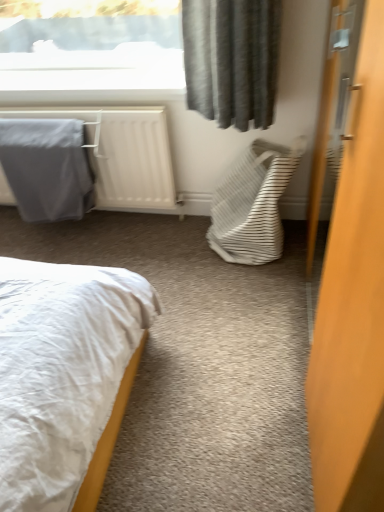
The width and height of the screenshot is (384, 512). What do you see at coordinates (122, 153) in the screenshot?
I see `gray fabric at left` at bounding box center [122, 153].

Describe the element at coordinates (47, 168) in the screenshot. I see `gray fabric blanket at left` at that location.

What are the coordinates of `gray fabric at left` in the screenshot? It's located at (122, 153).

Looking at this image, does white striped fabric laundry basket at center-right have a larger size compared to wooden door at right?

No, white striped fabric laundry basket at center-right is not bigger than wooden door at right.

Considering the points (270, 152) and (373, 45), which point is behind, point (270, 152) or point (373, 45)?

The point (270, 152) is farther.

Is white striped fabric laundry basket at center-right far from wooden door at right?

That's not correct — white striped fabric laundry basket at center-right is a little close to wooden door at right.

From the picture: From the image's perspective, is white striped fabric laundry basket at center-right positioned above or below wooden door at right?

From the image's perspective, white striped fabric laundry basket at center-right appears above wooden door at right.

Is white striped fabric laundry basket at center-right positioned far away from gray fabric blanket at left?

Actually, white striped fabric laundry basket at center-right and gray fabric blanket at left are a little close together.

Measure the distance from white striped fabric laundry basket at center-right to gray fabric blanket at left.

They are 82.64 centimeters apart.

Is white striped fabric laundry basket at center-right looking in the opposite direction of gray fabric blanket at left?

No, white striped fabric laundry basket at center-right's orientation is not away from gray fabric blanket at left.

Find the location of a particular element. This screenshot has width=384, height=512. blanket located behind the white striped fabric laundry basket at center-right is located at coordinates (47, 168).

Is gray fabric blanket at left positioned with its back to white striped fabric laundry basket at center-right?

gray fabric blanket at left does not have its back to white striped fabric laundry basket at center-right.

Is the surface of gray fabric blanket at left in direct contact with white striped fabric laundry basket at center-right?

No.

Looking at the image, does gray fabric blanket at left seem bigger or smaller compared to white striped fabric laundry basket at center-right?

In the image, gray fabric blanket at left appears to be smaller than white striped fabric laundry basket at center-right.

Is point (67, 154) positioned after point (271, 176)?

Yes.

Is point (367, 409) closer or farther from the camera than point (65, 137)?

Point (367, 409) is closer to the camera than point (65, 137).

In the scene shown: From a real-world perspective, is wooden door at right physically located above or below gray fabric blanket at left?

Clearly, from a real-world perspective, wooden door at right is above gray fabric blanket at left.

Which is correct: wooden door at right is inside gray fabric blanket at left, or outside of it?

wooden door at right lies outside gray fabric blanket at left.

Would you say wooden door at right is outside gray fabric at left?

wooden door at right is positioned outside gray fabric at left.

Which of these two, wooden door at right or gray fabric at left, is smaller?

With smaller size is gray fabric at left.

Which object is thinner, wooden door at right or gray fabric at left?

With smaller width is wooden door at right.

Is wooden door at right positioned before gray fabric at left?

Yes, it is in front of gray fabric at left.

From the image's perspective, between gray fabric blanket at left and gray fabric at left, which one is located above?

gray fabric at left, from the image's perspective.

Who is more distant, gray fabric blanket at left or gray fabric at left?

gray fabric blanket at left is further from the camera.

From a real-world perspective, is gray fabric blanket at left physically located above or below gray fabric at left?

Clearly, from a real-world perspective, gray fabric blanket at left is below gray fabric at left.

Is gray fabric blanket at left looking in the opposite direction of gray fabric at left?

Yes, gray fabric blanket at left is facing away from gray fabric at left.

Considering the sizes of objects gray fabric at left and gray fabric blanket at left in the image provided, who is bigger, gray fabric at left or gray fabric blanket at left?

gray fabric at left is bigger.

From the image's perspective, who appears lower, gray fabric at left or gray fabric blanket at left?

gray fabric blanket at left.

Could you tell me if gray fabric at left is turned towards gray fabric blanket at left?

Yes, gray fabric at left is aimed at gray fabric blanket at left.

In the scene shown: Would you say gray fabric at left is to the left or to the right of gray fabric blanket at left in the picture?

gray fabric at left is positioned on gray fabric blanket at left's left side.

Identify the location of door on the right of white striped fabric laundry basket at center-right. Image resolution: width=384 pixels, height=512 pixels. (353, 305).

The image size is (384, 512). Identify the location of blanket lying on the left of white striped fabric laundry basket at center-right. (47, 168).

Estimate the real-world distances between objects in this image. Which object is further from white striped fabric laundry basket at center-right, gray fabric at left or wooden door at right?

wooden door at right is positioned further to the anchor white striped fabric laundry basket at center-right.

Estimate the real-world distances between objects in this image. Which object is closer to wooden door at right, white striped fabric laundry basket at center-right or gray fabric at left?

Based on the image, white striped fabric laundry basket at center-right appears to be nearer to wooden door at right.

Estimate the real-world distances between objects in this image. Which object is further from white striped fabric laundry basket at center-right, gray fabric at left or gray fabric blanket at left?

The object further to white striped fabric laundry basket at center-right is gray fabric blanket at left.

Looking at the image, which one is located closer to white striped fabric laundry basket at center-right, wooden door at right or gray fabric blanket at left?

gray fabric blanket at left lies closer to white striped fabric laundry basket at center-right than the other object.

When comparing their distances from gray fabric at left, does white striped fabric laundry basket at center-right or wooden door at right seem closer?

white striped fabric laundry basket at center-right is positioned closer to the anchor gray fabric at left.

Estimate the real-world distances between objects in this image. Which object is closer to wooden door at right, gray fabric at left or white striped fabric laundry basket at center-right?

white striped fabric laundry basket at center-right is positioned closer to the anchor wooden door at right.

Estimate the real-world distances between objects in this image. Which object is further from gray fabric at left, wooden door at right or white striped fabric laundry basket at center-right?

Among the two, wooden door at right is located further to gray fabric at left.

Looking at the image, which one is located closer to white striped fabric laundry basket at center-right, gray fabric blanket at left or gray fabric at left?

Based on the image, gray fabric at left appears to be nearer to white striped fabric laundry basket at center-right.

Identify the location of laundry basket between wooden door at right and gray fabric blanket at left along the z-axis. (253, 203).

Locate an element on the screen. Image resolution: width=384 pixels, height=512 pixels. laundry basket between wooden door at right and gray fabric at left along the z-axis is located at coordinates (253, 203).

Identify the location of blanket between gray fabric at left and white striped fabric laundry basket at center-right from left to right. This screenshot has height=512, width=384. (47, 168).

What are the coordinates of `radiator between wooden door at right and gray fabric blanket at left from front to back` in the screenshot? It's located at pos(122,153).